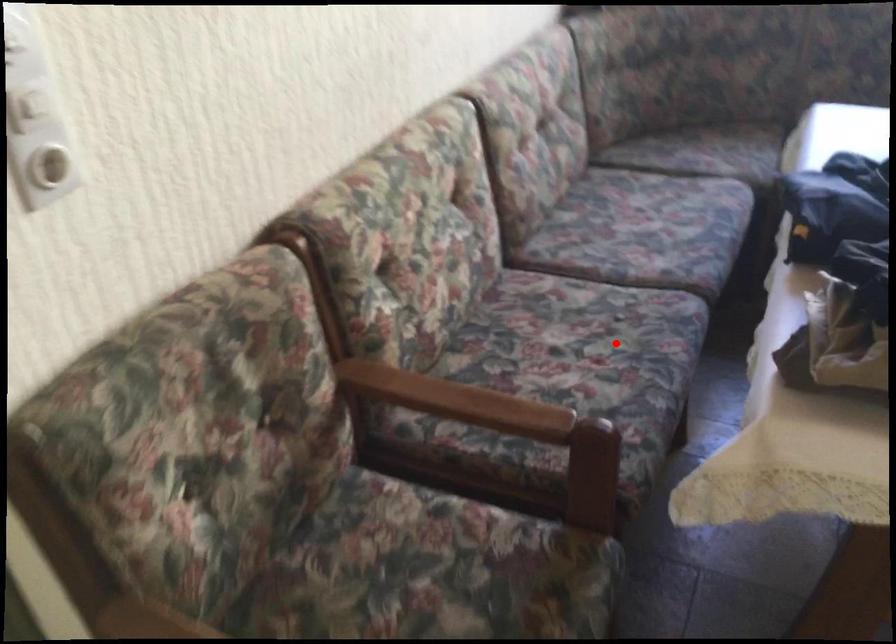
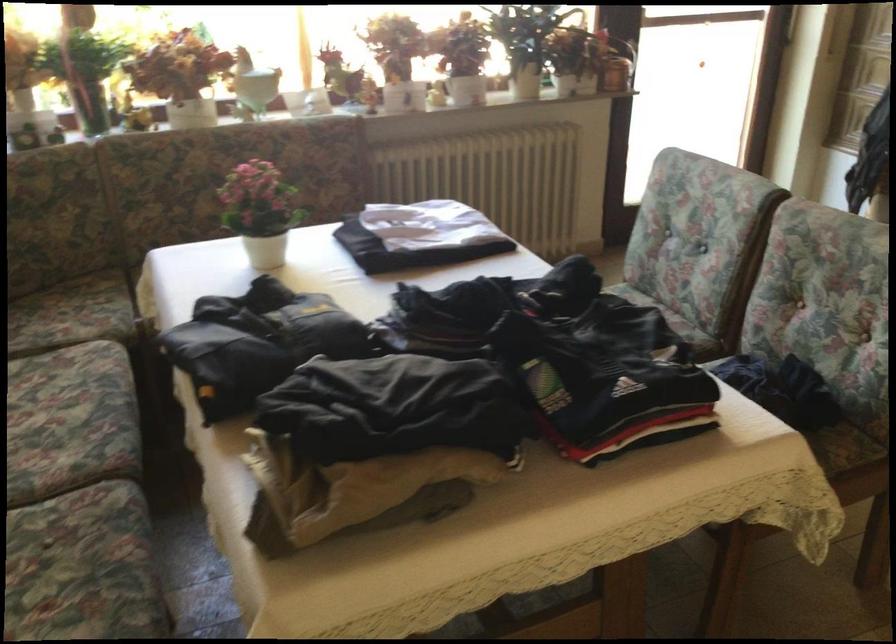
In the second image, find the point that corresponds to the highlighted location in the first image.

(83, 567)